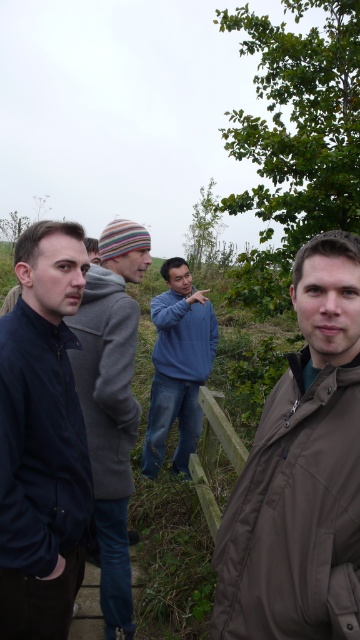
Based on the photo, is brown matte jacket at lower right positioned before matte black jacket at left?

Yes, it is.

Does point (304, 586) come in front of point (72, 493)?

Yes, it is.

The image size is (360, 640). I want to click on brown matte jacket at lower right, so click(x=294, y=515).

Is brown matte jacket at lower right below gray woolen jacket at left?

Indeed, brown matte jacket at lower right is positioned under gray woolen jacket at left.

Is point (303, 440) behind point (114, 369)?

No, it is not.

This screenshot has height=640, width=360. In order to click on brown matte jacket at lower right in this screenshot , I will do (x=294, y=515).

Between gray woolen jacket at left and green wooden fence at center, which one has less height?

green wooden fence at center is shorter.

Does point (132, 328) lie behind point (209, 529)?

No, it is not.

Image resolution: width=360 pixels, height=640 pixels. What are the coordinates of `gray woolen jacket at left` in the screenshot? It's located at coord(106,378).